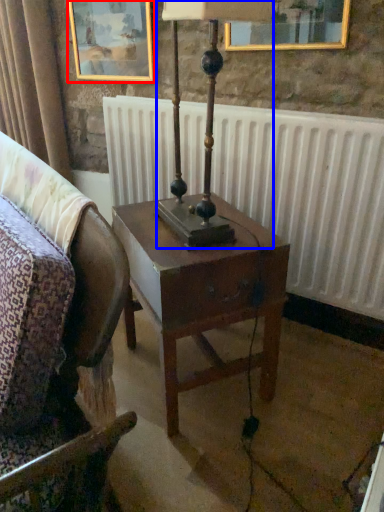
Question: Which point is closer to the camera, picture frame (highlighted by a red box) or bedside lamp (highlighted by a blue box)?

Choices:
 (A) picture frame
 (B) bedside lamp

Answer: (B)